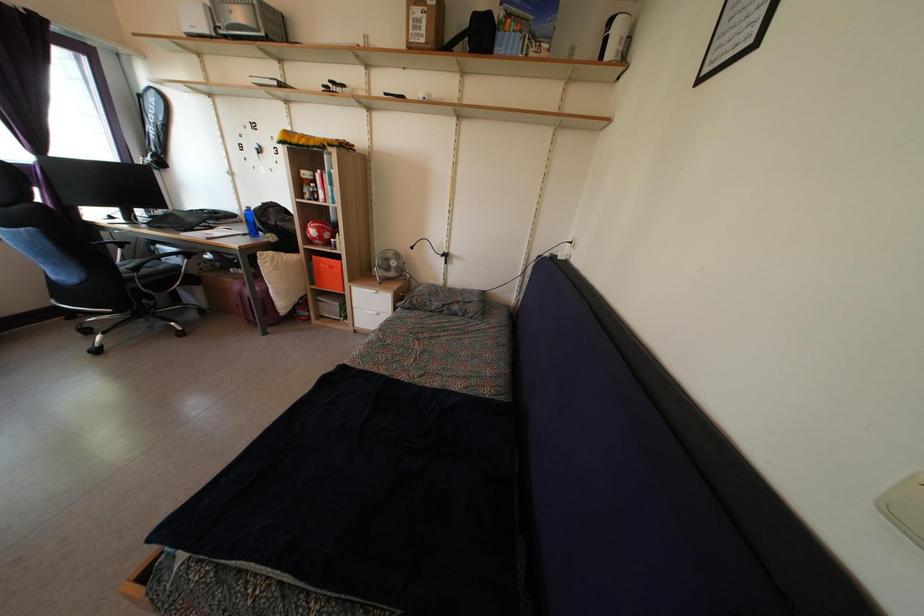
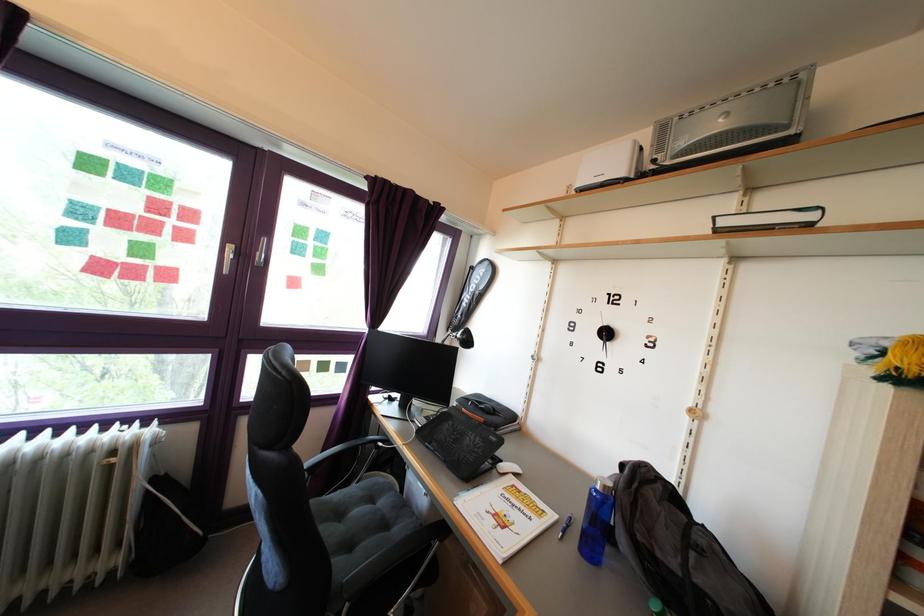
Where in the second image is the point corresponding to (251,217) from the first image?

(609, 496)